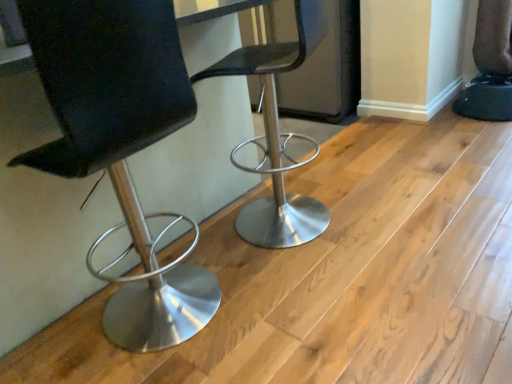
Question: Looking at the image, does metallic silver stool at center, the first chair viewed from the right, seem bigger or smaller compared to black leather chair at left, which is the 2th chair in right-to-left order?

Choices:
 (A) small
 (B) big

Answer: (A)

Question: From the image's perspective, relative to black leather chair at left, which is counted as the first chair, starting from the left, is metallic silver stool at center, marked as the 2th chair in a left-to-right arrangement, above or below?

Choices:
 (A) below
 (B) above

Answer: (B)

Question: Considering the positions of point (287, 51) and point (38, 56), is point (287, 51) closer or farther from the camera than point (38, 56)?

Choices:
 (A) closer
 (B) farther

Answer: (B)

Question: Considering the positions of black leather chair at left, which is counted as the first chair, starting from the left, and metallic silver stool at center, the first chair viewed from the right, in the image, is black leather chair at left, which is counted as the first chair, starting from the left, bigger or smaller than metallic silver stool at center, the first chair viewed from the right,?

Choices:
 (A) small
 (B) big

Answer: (B)

Question: Does point (97, 127) appear closer or farther from the camera than point (281, 238)?

Choices:
 (A) closer
 (B) farther

Answer: (A)

Question: Looking at their shapes, would you say black leather chair at left, which is the 2th chair in right-to-left order, is wider or thinner than metallic silver stool at center, the first chair viewed from the right?

Choices:
 (A) wide
 (B) thin

Answer: (B)

Question: Considering the positions of black leather chair at left, which is counted as the first chair, starting from the left, and metallic silver stool at center, marked as the 2th chair in a left-to-right arrangement, in the image, is black leather chair at left, which is counted as the first chair, starting from the left, taller or shorter than metallic silver stool at center, marked as the 2th chair in a left-to-right arrangement,?

Choices:
 (A) short
 (B) tall

Answer: (B)